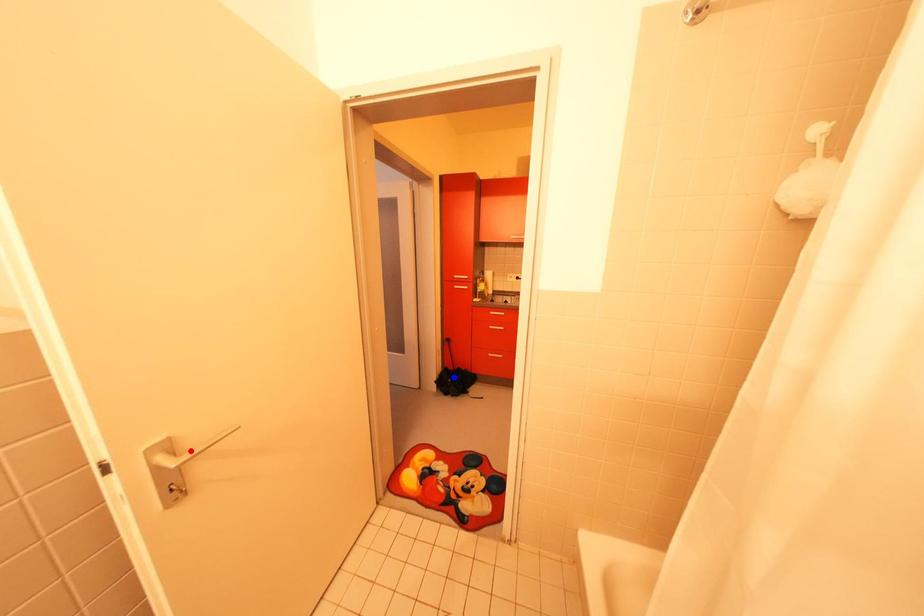
Question: Two points are marked on the image. Which point is closer to the camera?

Choices:
 (A) Blue point is closer.
 (B) Red point is closer.

Answer: (B)